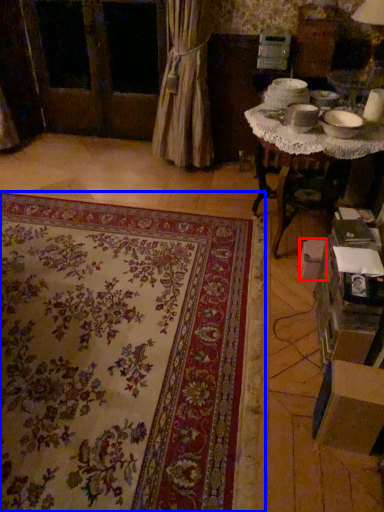
Question: Which object is closer to the camera taking this photo, cardboard box (highlighted by a red box) or mat (highlighted by a blue box)?

Choices:
 (A) cardboard box
 (B) mat

Answer: (B)